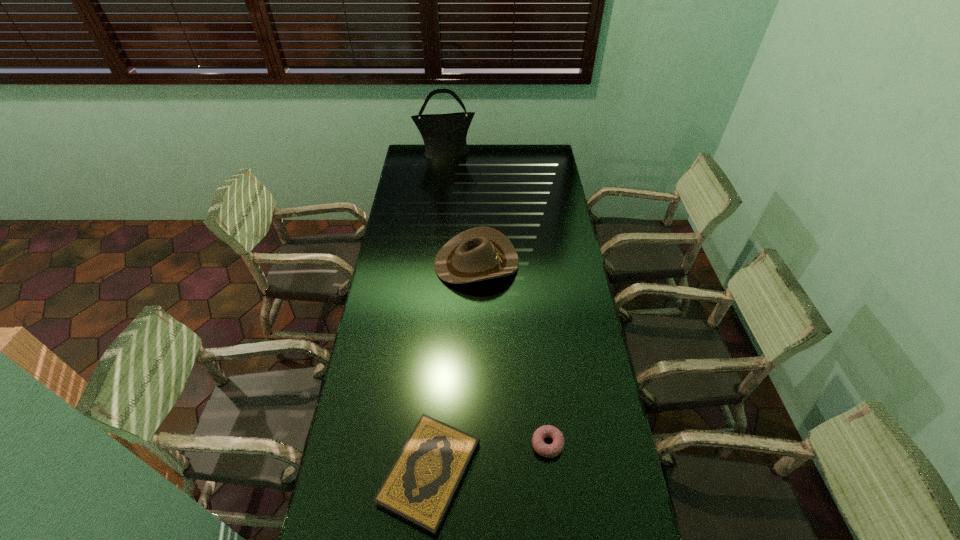
At what (x,y) coordinates should I click in order to perform the action: click on free space that satisfies the following two spatial constraints: 1. on the back side of the doughnut; 2. with a star on the front of the second farthest object. Please return your answer as a coordinate pair (x, y). This screenshot has width=960, height=540. Looking at the image, I should click on (528, 263).

The height and width of the screenshot is (540, 960). I want to click on vacant region that satisfies the following two spatial constraints: 1. with a star on the front of the second farthest object; 2. on the left side of the doughnut, so click(x=475, y=444).

Image resolution: width=960 pixels, height=540 pixels. I want to click on vacant position in the image that satisfies the following two spatial constraints: 1. with a star on the front of the doughnut; 2. on the left side of the second farthest object, so click(x=475, y=444).

This screenshot has width=960, height=540. What are the coordinates of `free space that satisfies the following two spatial constraints: 1. with a star on the front of the doughnut; 2. on the left side of the cowboy hat` in the screenshot? It's located at [x=475, y=444].

What are the coordinates of `vacant space that satisfies the following two spatial constraints: 1. on the back side of the doughnut; 2. on the right side of the shortest object` in the screenshot? It's located at (432, 444).

Identify the location of vacant space that satisfies the following two spatial constraints: 1. with a star on the front of the doughnut; 2. on the left side of the second farthest object. (475, 444).

This screenshot has width=960, height=540. I want to click on vacant position in the image that satisfies the following two spatial constraints: 1. on the back side of the doughnut; 2. with a star on the front of the third nearest object, so click(x=528, y=263).